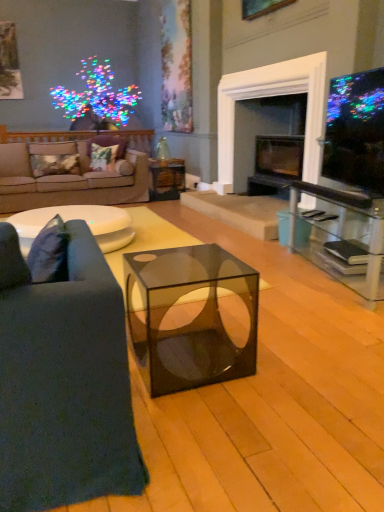
Question: Is matte black tv at upper right shorter than black glass fireplace at center?

Choices:
 (A) no
 (B) yes

Answer: (B)

Question: Considering the relative sizes of matte black tv at upper right and black glass fireplace at center in the image provided, is matte black tv at upper right taller than black glass fireplace at center?

Choices:
 (A) no
 (B) yes

Answer: (A)

Question: From the image's perspective, would you say matte black tv at upper right is shown under black glass fireplace at center?

Choices:
 (A) yes
 (B) no

Answer: (A)

Question: Is matte black tv at upper right touching black glass fireplace at center?

Choices:
 (A) yes
 (B) no

Answer: (B)

Question: Does matte black tv at upper right come behind black glass fireplace at center?

Choices:
 (A) no
 (B) yes

Answer: (A)

Question: Could you tell me if matte black tv at upper right is facing black glass fireplace at center?

Choices:
 (A) no
 (B) yes

Answer: (A)

Question: Could you tell me if matte black tv at upper right is turned towards beige fabric couch at left, the 2th studio couch from the bottom?

Choices:
 (A) no
 (B) yes

Answer: (A)

Question: Can you confirm if matte black tv at upper right is thinner than beige fabric couch at left, the 2th studio couch from the bottom?

Choices:
 (A) no
 (B) yes

Answer: (B)

Question: Can you confirm if matte black tv at upper right is positioned to the right of beige fabric couch at left, arranged as the second studio couch when viewed from the right?

Choices:
 (A) yes
 (B) no

Answer: (A)

Question: From a real-world perspective, is matte black tv at upper right physically above beige fabric couch at left, arranged as the second studio couch when viewed from the right?

Choices:
 (A) yes
 (B) no

Answer: (A)

Question: Is matte black tv at upper right wider than beige fabric couch at left, the 1th studio couch when ordered from top to bottom?

Choices:
 (A) yes
 (B) no

Answer: (B)

Question: Is beige fabric couch at left, which is counted as the 1th studio couch, starting from the left, inside matte black tv at upper right?

Choices:
 (A) yes
 (B) no

Answer: (B)

Question: From the image's perspective, is dark blue fabric couch at left, arranged as the 1th studio couch when ordered from the bottom, on top of metallic gold pillow at left, placed as the first pillow when sorted from left to right?

Choices:
 (A) no
 (B) yes

Answer: (A)